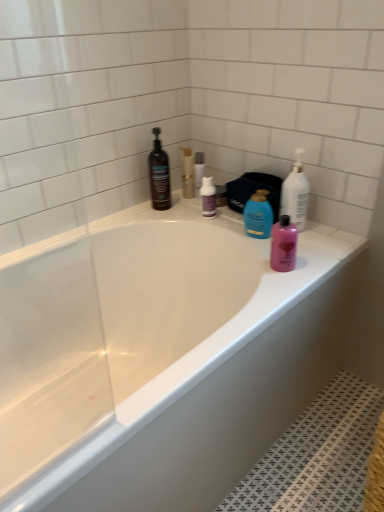
Where is `free space in front of gold metallic soap dispenser at upper center, which is the first toiletry in left-to-right order`? This screenshot has height=512, width=384. free space in front of gold metallic soap dispenser at upper center, which is the first toiletry in left-to-right order is located at coordinates (186, 205).